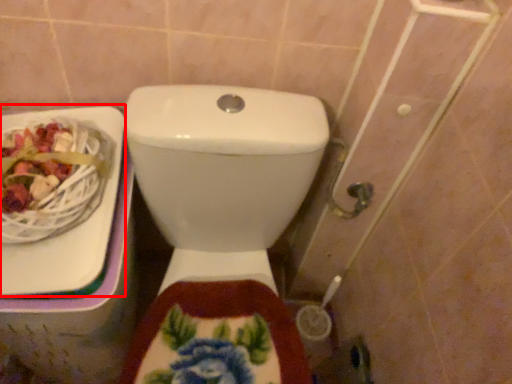
Question: Considering the relative positions of sink (annotated by the red box) and toilet in the image provided, where is sink (annotated by the red box) located with respect to the staircase?

Choices:
 (A) left
 (B) right

Answer: (A)